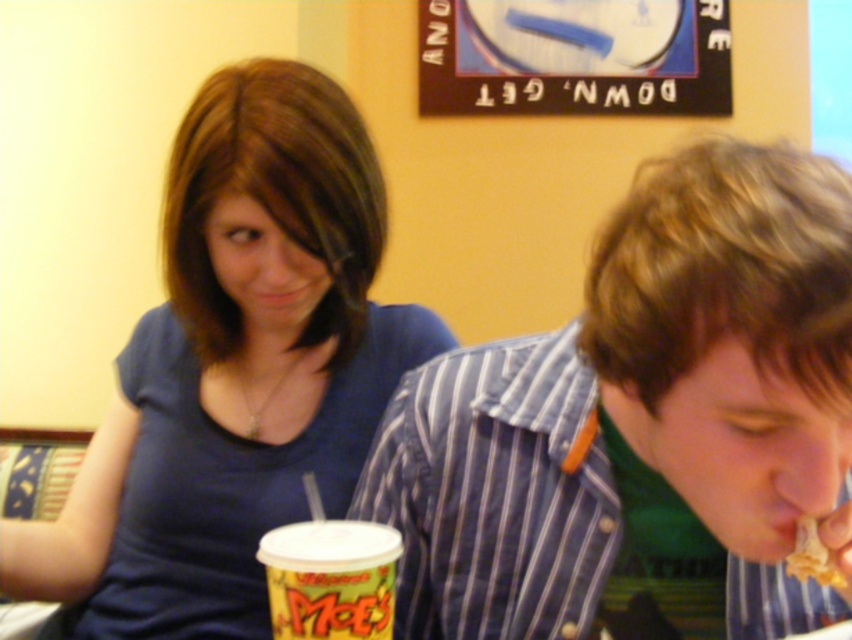
Looking at this image, is striped cotton shirt at right wider than yellowish-brown crispy snack at lower right?

Correct, the width of striped cotton shirt at right exceeds that of yellowish-brown crispy snack at lower right.

Does point (658, 420) come behind point (786, 563)?

No, it is in front of (786, 563).

Who is more forward, (640,289) or (815,550)?

Point (640,289) is more forward.

The width and height of the screenshot is (852, 640). In order to click on striped cotton shirt at right in this screenshot , I will do 643,424.

Who is positioned more to the right, striped cotton shirt at right or yellow paper cup at lower center?

Positioned to the right is striped cotton shirt at right.

Can you confirm if striped cotton shirt at right is smaller than yellow paper cup at lower center?

No.

Between point (491, 355) and point (323, 589), which one is positioned in front?

Point (323, 589) is more forward.

In order to click on striped cotton shirt at right in this screenshot , I will do `click(643, 424)`.

Who is lower down, yellow paper cup at lower center or yellowish-brown crispy snack at lower right?

yellow paper cup at lower center is below.

Based on the photo, is yellow paper cup at lower center positioned in front of yellowish-brown crispy snack at lower right?

Yes, it is.

You are a GUI agent. You are given a task and a screenshot of the screen. Output one action in this format:
    pyautogui.click(x=<x>, y=<y>)
    Task: Click on the yellow paper cup at lower center
    The width and height of the screenshot is (852, 640).
    Given the screenshot: What is the action you would take?
    pyautogui.click(x=330, y=579)